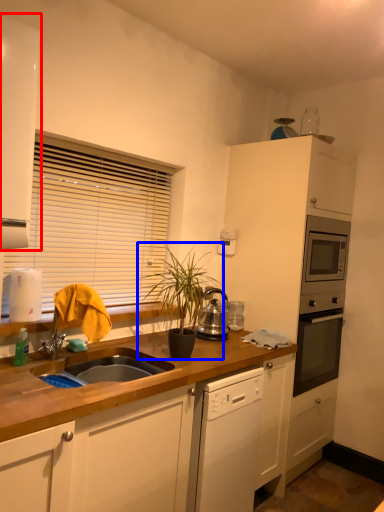
Question: Which of the following is the farthest to the observer, cabinetry (highlighted by a red box) or houseplant (highlighted by a blue box)?

Choices:
 (A) cabinetry
 (B) houseplant

Answer: (B)